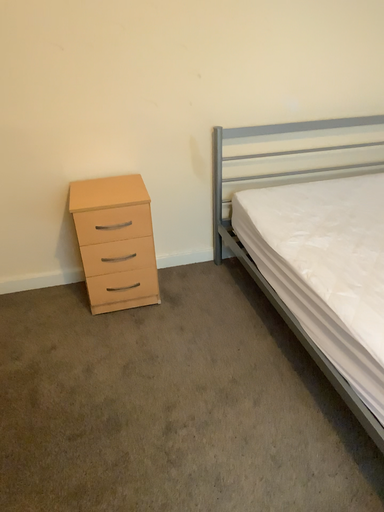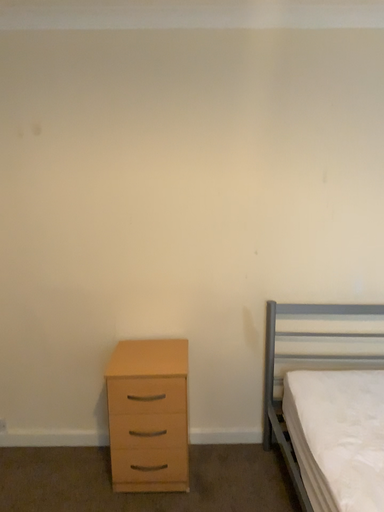
Question: How did the camera likely rotate when shooting the video?

Choices:
 (A) rotated left
 (B) rotated right

Answer: (A)